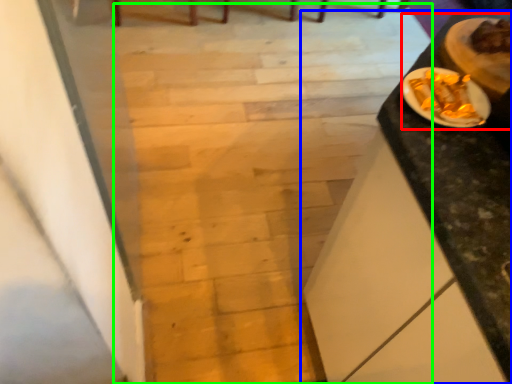
Question: Which object is positioned closest to dinner (highlighted by a red box)? Select from table (highlighted by a blue box) and stairwell (highlighted by a green box).

Choices:
 (A) table
 (B) stairwell

Answer: (A)